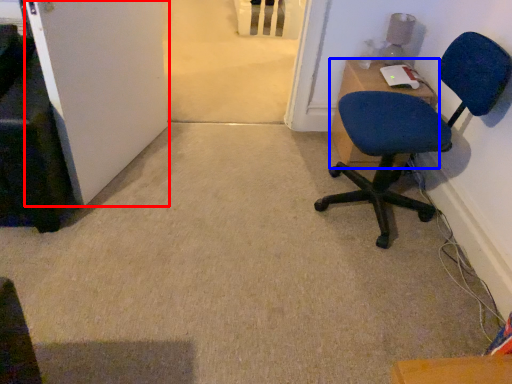
Question: Which object appears farthest to the camera in this image, door (highlighted by a red box) or desk (highlighted by a blue box)?

Choices:
 (A) door
 (B) desk

Answer: (B)